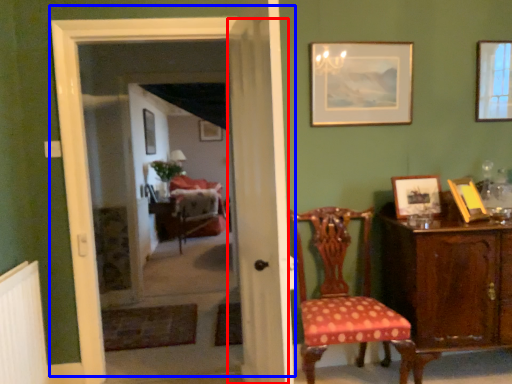
Question: Which object appears farthest to the camera in this image, curtain (highlighted by a red box) or door (highlighted by a blue box)?

Choices:
 (A) curtain
 (B) door

Answer: (B)